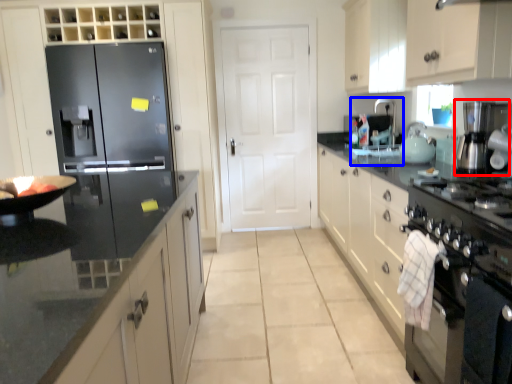
Question: Which object is further to the camera taking this photo, appliance (highlighted by a red box) or sink (highlighted by a blue box)?

Choices:
 (A) appliance
 (B) sink

Answer: (B)